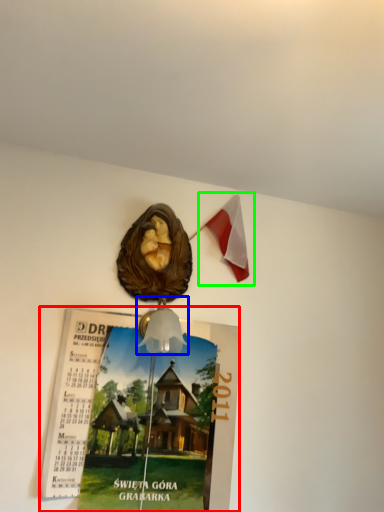
Question: Based on their relative distances, which object is farther from poster page (highlighted by a red box)? Choose from lamp (highlighted by a blue box) and flag (highlighted by a green box).

Choices:
 (A) lamp
 (B) flag

Answer: (B)